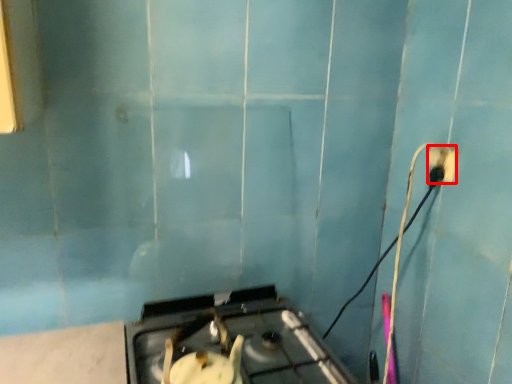
Question: In this image, where is power plugs and sockets (annotated by the red box) located relative to gas stove?

Choices:
 (A) left
 (B) right

Answer: (B)